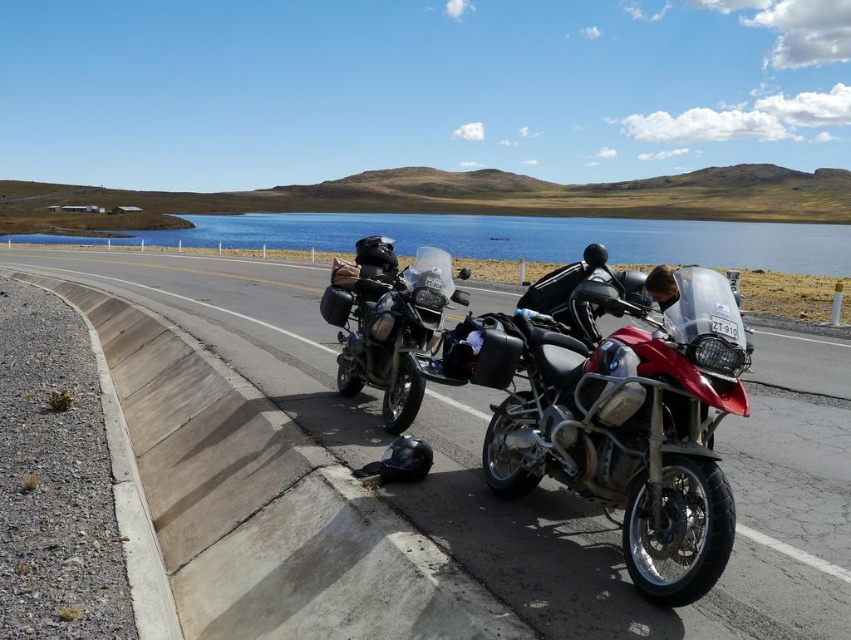
Question: Which object is positioned closest to the blue glassy water at center?

Choices:
 (A) metallic silver motorcycle at center
 (B) matte black motorcycle at center

Answer: (A)

Question: Which object is closer to the camera taking this photo?

Choices:
 (A) blue glassy water at center
 (B) asphalt road at center
 (C) metallic silver motorcycle at center

Answer: (C)

Question: Which object appears farthest from the camera in this image?

Choices:
 (A) blue glassy water at center
 (B) asphalt road at center
 (C) matte black motorcycle at center
 (D) metallic silver motorcycle at center

Answer: (A)

Question: Can you confirm if metallic silver motorcycle at center is positioned above blue glassy water at center?

Choices:
 (A) no
 (B) yes

Answer: (A)

Question: Does blue glassy water at center appear under matte black motorcycle at center?

Choices:
 (A) no
 (B) yes

Answer: (A)

Question: Does asphalt road at center come behind metallic silver motorcycle at center?

Choices:
 (A) no
 (B) yes

Answer: (B)